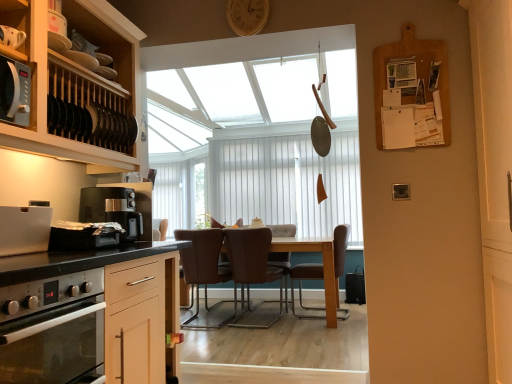
What is the approximate width of matte black plate rack at left?

The width of matte black plate rack at left is 14.81 inches.

Identify the location of wooden clock at upper center. The height and width of the screenshot is (384, 512). (247, 16).

The width and height of the screenshot is (512, 384). Find the location of `shiny metallic toaster at left`. shiny metallic toaster at left is located at coordinates (84, 235).

This screenshot has width=512, height=384. What are the coordinates of `black glass oven at lower left` in the screenshot? It's located at (53, 330).

Consider the image. What is the approximate height of black plastic coffee maker at left?

12.78 inches.

This screenshot has width=512, height=384. Identify the location of burlap bulletin board at upper right. (411, 92).

You are a GUI agent. You are given a task and a screenshot of the screen. Output one action in this format:
    pyautogui.click(x=<x>, y=<y>)
    Task: Click on the matte black plate rack at left
    
    Given the screenshot: What is the action you would take?
    pyautogui.click(x=78, y=83)

Are burlap bulletin board at upper right and brown leather chair at center, which ranks as the 1th chair in right-to-left order, beside each other?

No, burlap bulletin board at upper right is not next to brown leather chair at center, which ranks as the 1th chair in right-to-left order.

Can you confirm if burlap bulletin board at upper right is positioned to the left of brown leather chair at center, placed as the third chair when sorted from left to right?

No.

Is burlap bulletin board at upper right completely or partially outside of brown leather chair at center, which ranks as the 1th chair in right-to-left order?

Yes, burlap bulletin board at upper right is not within brown leather chair at center, which ranks as the 1th chair in right-to-left order.

From the image's perspective, is burlap bulletin board at upper right under brown leather chair at center, which ranks as the 1th chair in right-to-left order?

Actually, burlap bulletin board at upper right appears above brown leather chair at center, which ranks as the 1th chair in right-to-left order, in the image.

Is point (378, 68) closer to camera compared to point (207, 314)?

Yes.

Considering the relative sizes of burlap bulletin board at upper right and brown leather chair at center, acting as the first chair starting from the left, in the image provided, is burlap bulletin board at upper right shorter than brown leather chair at center, acting as the first chair starting from the left,?

Correct, burlap bulletin board at upper right is not as tall as brown leather chair at center, acting as the first chair starting from the left.

Locate an element on the screen. The width and height of the screenshot is (512, 384). bulletin board that is above the brown leather chair at center, acting as the first chair starting from the left (from the image's perspective) is located at coordinates (411, 92).

How different are the orientations of burlap bulletin board at upper right and brown leather chair at center, the third chair when ordered from right to left, in degrees?

They differ by 179 degrees in their facing directions.

Is the position of brown leather swivel chair at center less distant than that of black glass oven at lower left?

No, brown leather swivel chair at center is further to the viewer.

Is brown leather swivel chair at center taller or shorter than black glass oven at lower left?

In the image, brown leather swivel chair at center appears to be taller than black glass oven at lower left.

Are brown leather swivel chair at center and black glass oven at lower left beside each other?

No, brown leather swivel chair at center is not with black glass oven at lower left.

How different are the orientations of brown leather swivel chair at center and black glass oven at lower left in degrees?

The angular difference between brown leather swivel chair at center and black glass oven at lower left is 91.9 degrees.

Is brown leather swivel chair at center far from brown leather chair at center, placed as the third chair when sorted from left to right?

That's not correct — brown leather swivel chair at center is a little close to brown leather chair at center, placed as the third chair when sorted from left to right.

Is brown leather swivel chair at center facing towards brown leather chair at center, placed as the third chair when sorted from left to right?

No, brown leather swivel chair at center does not turn towards brown leather chair at center, placed as the third chair when sorted from left to right.

Is brown leather swivel chair at center bigger or smaller than brown leather chair at center, which ranks as the 1th chair in right-to-left order?

Clearly, brown leather swivel chair at center is smaller in size than brown leather chair at center, which ranks as the 1th chair in right-to-left order.

Looking at this image, from the image's perspective, which is below, burlap bulletin board at upper right or brown leather chair at center, the second chair in the right-to-left sequence?

brown leather chair at center, the second chair in the right-to-left sequence.

Image resolution: width=512 pixels, height=384 pixels. I want to click on bulletin board lying in front of the brown leather chair at center, placed as the second chair when sorted from left to right, so click(x=411, y=92).

Is burlap bulletin board at upper right surrounding brown leather chair at center, placed as the second chair when sorted from left to right?

That's incorrect, brown leather chair at center, placed as the second chair when sorted from left to right, is not inside burlap bulletin board at upper right.

From a real-world perspective, which is physically above, burlap bulletin board at upper right or brown leather chair at center, placed as the second chair when sorted from left to right?

In real-world perspective, burlap bulletin board at upper right is above.

Is brown leather swivel chair at center aimed at matte black plate rack at left?

Yes, brown leather swivel chair at center is aimed at matte black plate rack at left.

Relative to matte black plate rack at left, is brown leather swivel chair at center in front or behind?

Clearly, brown leather swivel chair at center is behind matte black plate rack at left.

How different are the orientations of brown leather swivel chair at center and matte black plate rack at left in degrees?

The facing directions of brown leather swivel chair at center and matte black plate rack at left are 93 degrees apart.

Which is correct: brown leather swivel chair at center is inside matte black plate rack at left, or outside of it?

brown leather swivel chair at center exists outside the volume of matte black plate rack at left.

Would you say brown leather swivel chair at center is to the left or to the right of brown leather chair at center, the second chair in the right-to-left sequence, in the picture?

brown leather swivel chair at center is positioned on brown leather chair at center, the second chair in the right-to-left sequence,'s right side.

Who is shorter, brown leather swivel chair at center or brown leather chair at center, the second chair in the right-to-left sequence?

With less height is brown leather swivel chair at center.

Which of these two, brown leather swivel chair at center or brown leather chair at center, the second chair in the right-to-left sequence, is smaller?

brown leather swivel chair at center.

Where is `bulletin board that appears above the brown leather chair at center, which ranks as the 1th chair in right-to-left order (from a real-world perspective)`? This screenshot has width=512, height=384. bulletin board that appears above the brown leather chair at center, which ranks as the 1th chair in right-to-left order (from a real-world perspective) is located at coordinates (411, 92).

Where is `bulletin board on the right of brown leather chair at center, the third chair when ordered from right to left`? This screenshot has width=512, height=384. bulletin board on the right of brown leather chair at center, the third chair when ordered from right to left is located at coordinates (411, 92).

When comparing their distances from black plastic coffee maker at left, does wooden clock at upper center or brown leather chair at center, placed as the second chair when sorted from left to right, seem closer?

Based on the image, wooden clock at upper center appears to be nearer to black plastic coffee maker at left.

Based on their spatial positions, is brown leather chair at center, the second chair in the right-to-left sequence, or brown leather swivel chair at center closer to black glass oven at lower left?

brown leather chair at center, the second chair in the right-to-left sequence.

Which object lies further to the anchor point burlap bulletin board at upper right, wooden clock at upper center or brown leather chair at center, which ranks as the 1th chair in right-to-left order?

brown leather chair at center, which ranks as the 1th chair in right-to-left order.

Looking at the image, which one is located further to wooden clock at upper center, brown leather swivel chair at center or burlap bulletin board at upper right?

The object further to wooden clock at upper center is brown leather swivel chair at center.

Estimate the real-world distances between objects in this image. Which object is further from brown leather chair at center, the third chair when ordered from right to left, brown leather chair at center, placed as the third chair when sorted from left to right, or shiny metallic toaster at left?

shiny metallic toaster at left lies further to brown leather chair at center, the third chair when ordered from right to left, than the other object.

Based on their spatial positions, is burlap bulletin board at upper right or wooden clock at upper center further from shiny metallic toaster at left?

The object further to shiny metallic toaster at left is burlap bulletin board at upper right.

From the image, which object appears to be nearer to wooden clock at upper center, black plastic coffee maker at left or black glass oven at lower left?

Based on the image, black plastic coffee maker at left appears to be nearer to wooden clock at upper center.

Looking at the image, which one is located further to wooden clock at upper center, brown leather chair at center, the second chair in the right-to-left sequence, or matte black plate rack at left?

brown leather chair at center, the second chair in the right-to-left sequence, is positioned further to the anchor wooden clock at upper center.

The image size is (512, 384). What are the coordinates of `kitchen appliance between burlap bulletin board at upper right and brown leather chair at center, placed as the third chair when sorted from left to right, from front to back` in the screenshot? It's located at (114, 210).

This screenshot has width=512, height=384. I want to click on kitchen appliance between wooden clock at upper center and brown leather chair at center, acting as the first chair starting from the left, in the vertical direction, so click(x=114, y=210).

At what (x,y) coordinates should I click in order to perform the action: click on clock between matte black plate rack at left and brown leather chair at center, which ranks as the 1th chair in right-to-left order, in the front-back direction. Please return your answer as a coordinate pair (x, y). Looking at the image, I should click on (247, 16).

The image size is (512, 384). Find the location of `clock between shiny metallic toaster at left and brown leather swivel chair at center in the front-back direction`. clock between shiny metallic toaster at left and brown leather swivel chair at center in the front-back direction is located at coordinates (247, 16).